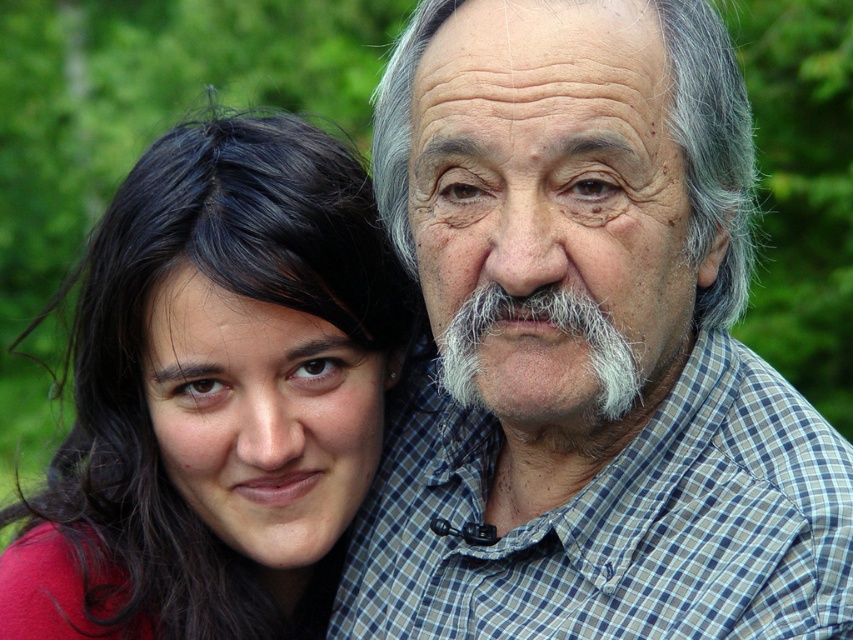
You are a photographer trying to frame a shot of the gray checkered shirt at upper right and the white fuzzy beard at center. Which object should you adjust your camera to focus on first if you want to capture both in the same frame without zooming?

The gray checkered shirt at upper right is wider than the white fuzzy beard at center, so you should focus on the wider object first to ensure it fits within the frame.